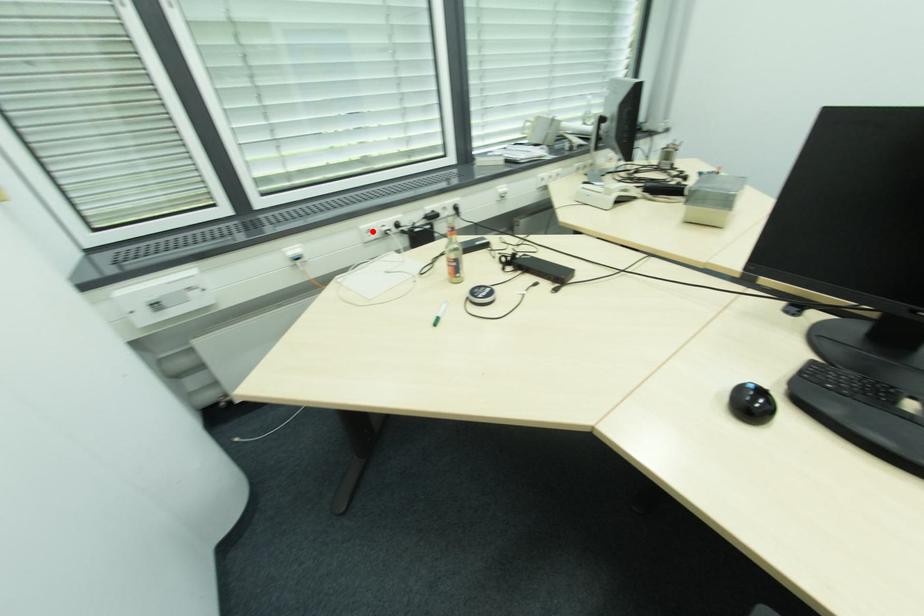
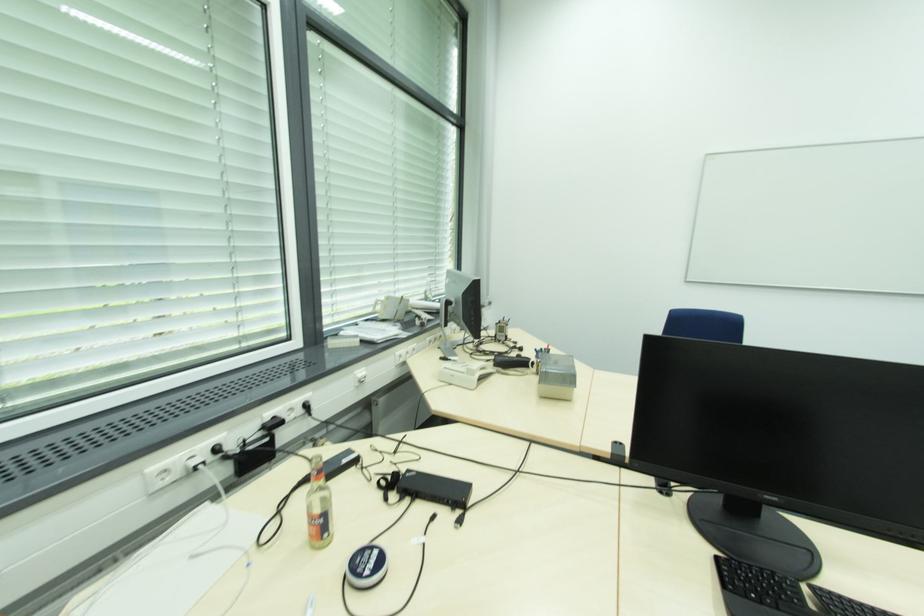
Question: I am providing you with two images of the same scene from different viewpoints. Image1 has a red point marked. In image2, the corresponding 3D location appears at what relative position? Reply with the corresponding letter.

Choices:
 (A) Closer
 (B) Farther

Answer: (B)